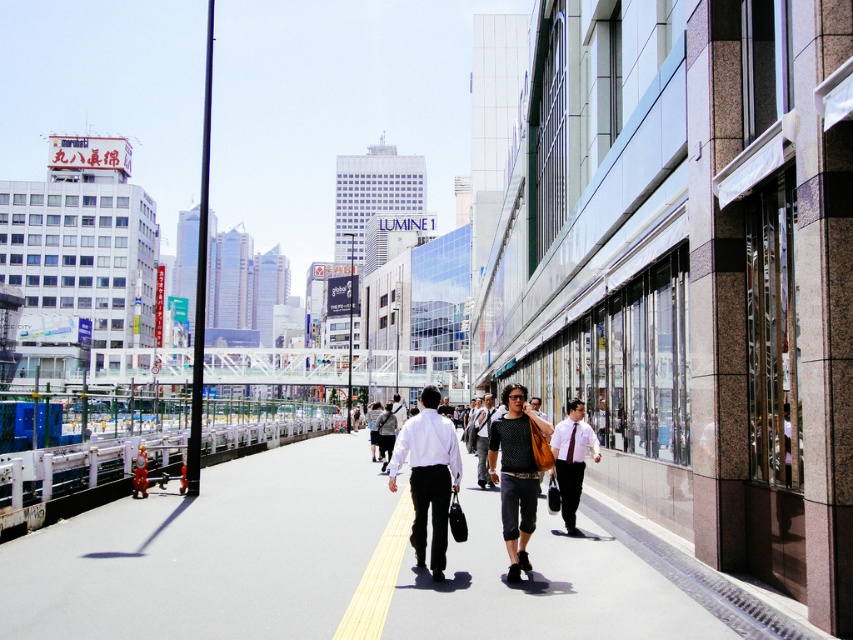
You are a fashion designer observing a person walking on a busy street in Japan. You notice a person wearing a white glossy shirt at center and black textured pants at center. Which piece of clothing is positioned to the left?

The white glossy shirt at center is positioned to the left of the black textured pants at center.